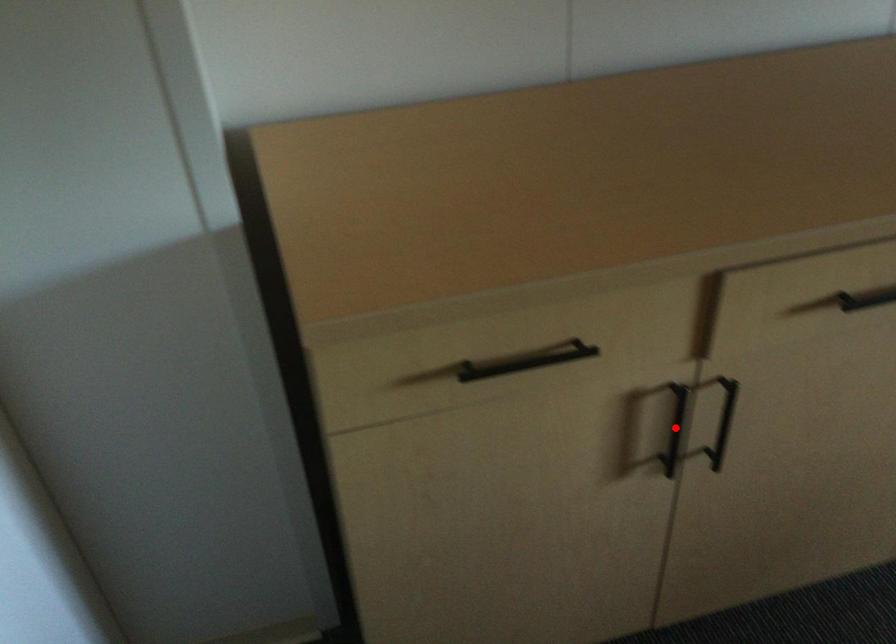
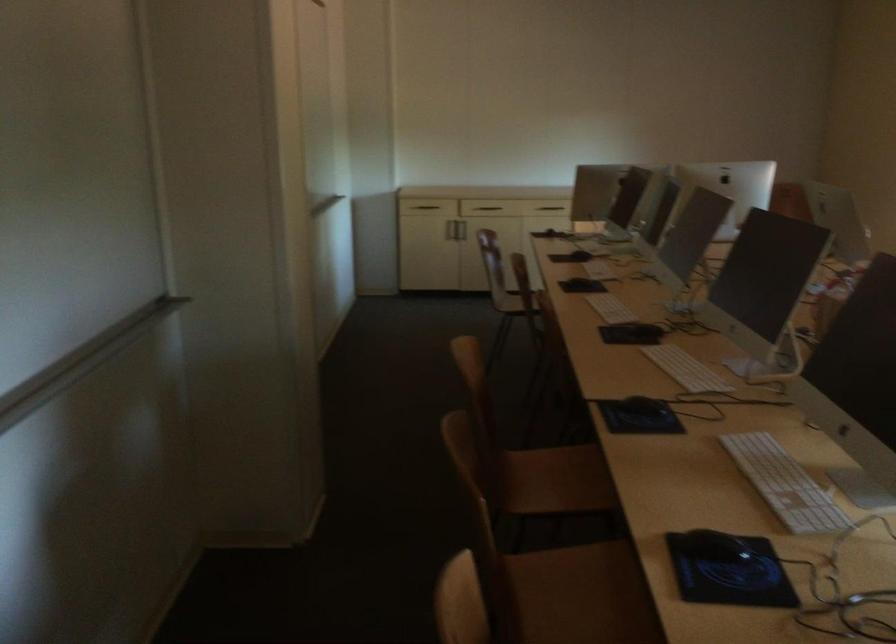
Question: I am providing you with two images of the same scene from different viewpoints. A red point is marked on the first image. At the location where the point appears in image 1, is it still visible in image 2?

Choices:
 (A) Yes
 (B) No

Answer: (B)